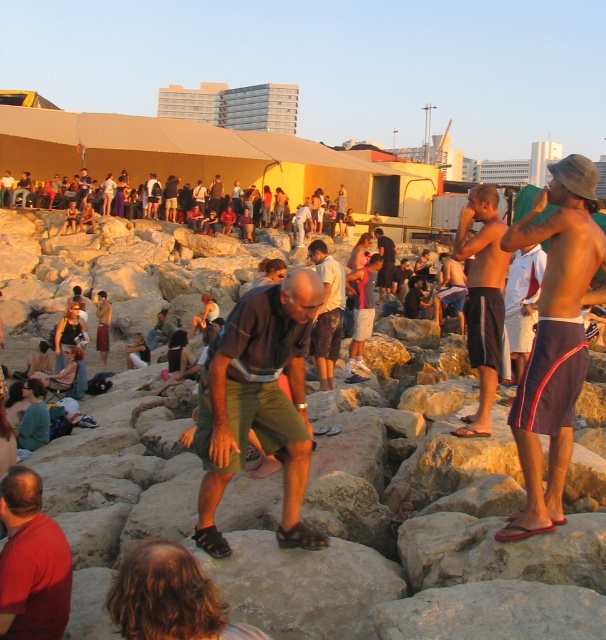
Question: Does dark green shorts at center have a greater width compared to dark blue shorts at center?

Choices:
 (A) yes
 (B) no

Answer: (B)

Question: In this image, where is dark brown leather shorts at center located relative to matte yellow tent at upper center?

Choices:
 (A) right
 (B) left

Answer: (A)

Question: Does red matte shirt at lower left have a greater width compared to matte yellow tent at upper center?

Choices:
 (A) no
 (B) yes

Answer: (A)

Question: Based on their relative distances, which object is farther from the dark brown leather shorts at center?

Choices:
 (A) dark green shorts at center
 (B) dark blue shorts at center

Answer: (B)

Question: Estimate the real-world distances between objects in this image. Which object is farther from the dark blue shorts at center?

Choices:
 (A) red matte shirt at lower left
 (B) natural stone rocks at center

Answer: (A)

Question: Which object appears farthest from the camera in this image?

Choices:
 (A) dark blue shorts at center
 (B) natural stone rocks at center

Answer: (A)